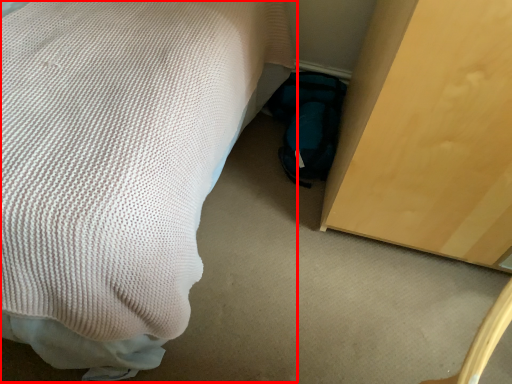
Question: From the image's perspective, what is the correct spatial positioning of bed (annotated by the red box) in reference to bag?

Choices:
 (A) below
 (B) above

Answer: (B)